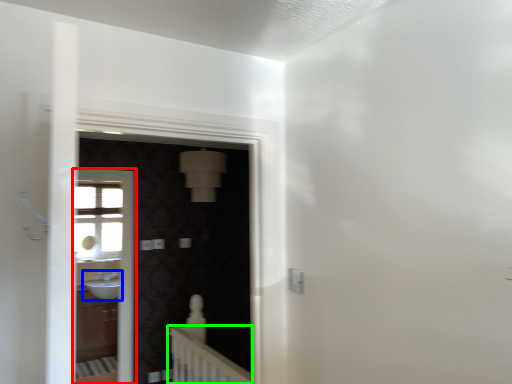
Question: Which is farther away from screen door (highlighted by a red box)? sink (highlighted by a blue box) or balustrade (highlighted by a green box)?

Choices:
 (A) sink
 (B) balustrade

Answer: (B)